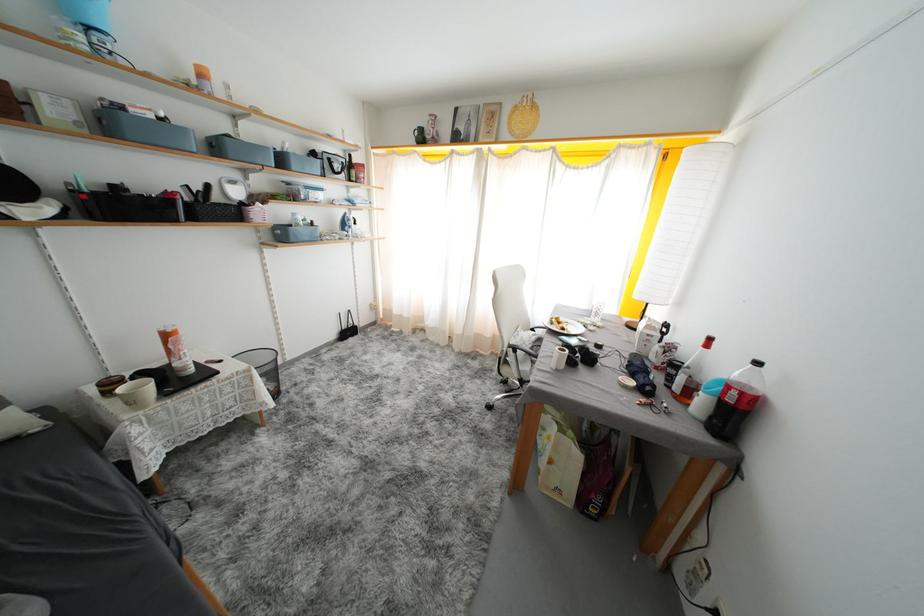
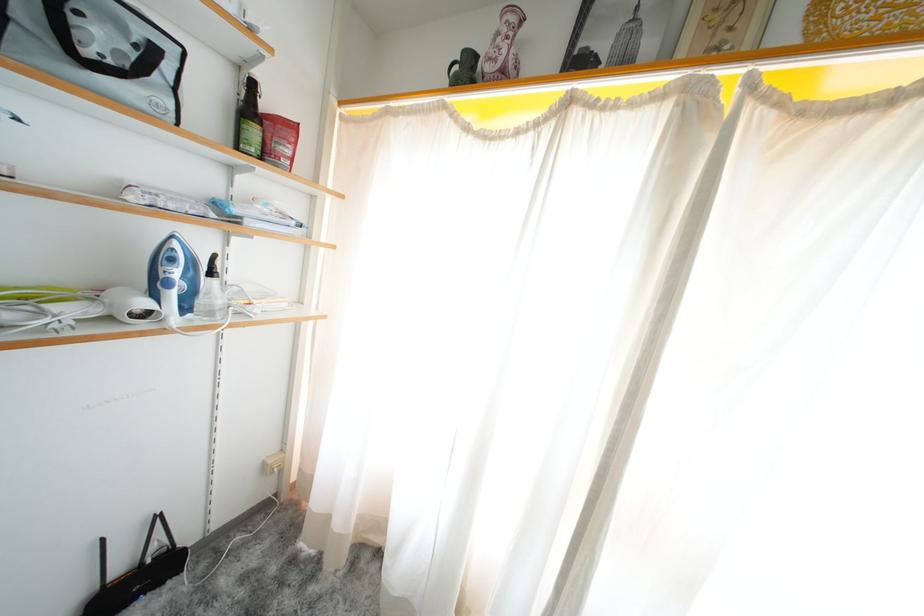
The point at (361, 228) is marked in the first image. Where is the corresponding point in the second image?

(217, 278)